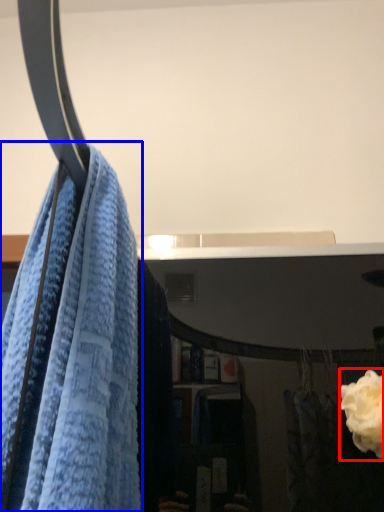
Question: Among these objects, which one is nearest to the camera, rose (highlighted by a red box) or towel (highlighted by a blue box)?

Choices:
 (A) rose
 (B) towel

Answer: (B)